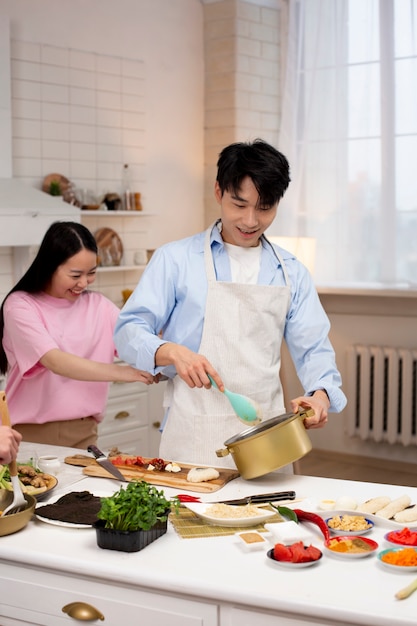
I want to click on cutting board, so point(158,473).